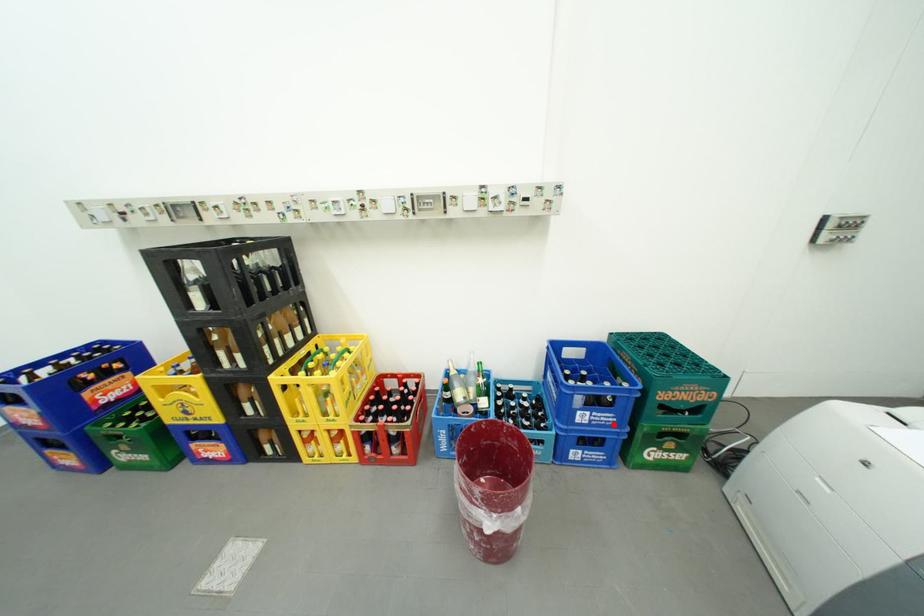
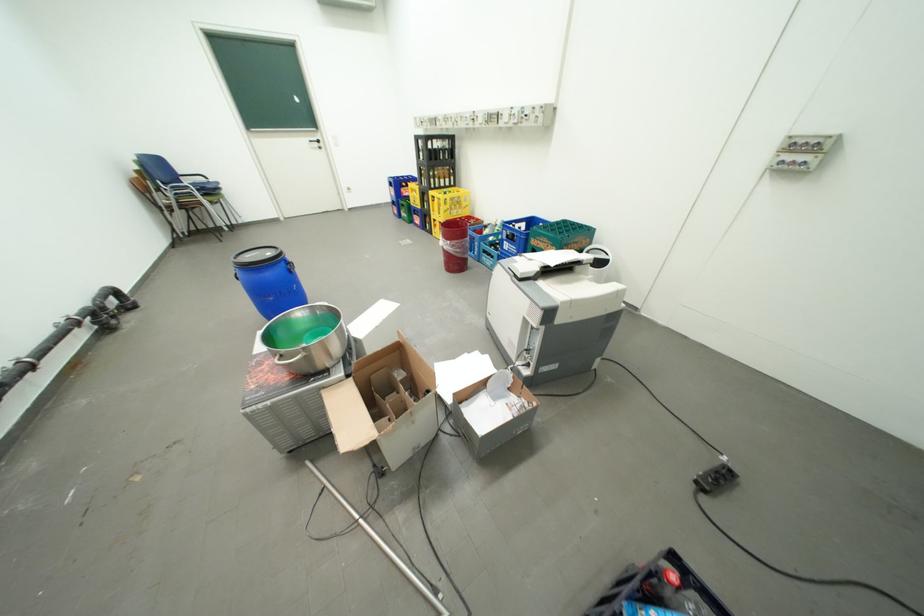
Question: I am providing you with two images of the same scene from different viewpoints. Given a red point in image1, look at the same physical point in image2. Is it:

Choices:
 (A) Closer to the viewpoint
 (B) Farther from the viewpoint

Answer: (B)